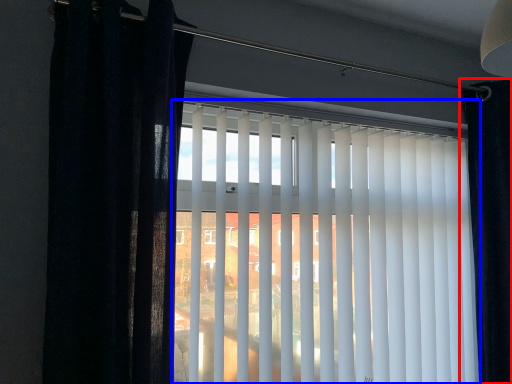
Question: Among these objects, which one is farthest to the camera, curtain (highlighted by a red box) or window blind (highlighted by a blue box)?

Choices:
 (A) curtain
 (B) window blind

Answer: (A)